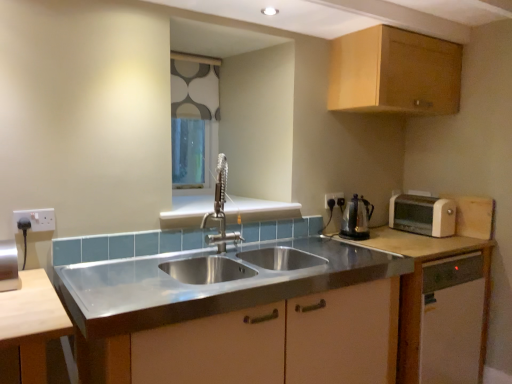
Question: Is stainless steel sink at center, which is counted as the 2th cabinetry, starting from the bottom, placed right next to white matte cabinet at right, the first cabinetry from the bottom?

Choices:
 (A) yes
 (B) no

Answer: (B)

Question: Can you confirm if stainless steel sink at center, marked as the 2th cabinetry in a top-to-bottom arrangement, is thinner than white matte cabinet at right, the first cabinetry from the bottom?

Choices:
 (A) no
 (B) yes

Answer: (A)

Question: Is stainless steel sink at center, which is counted as the 2th cabinetry, starting from the bottom, positioned behind white matte cabinet at right, which appears as the third cabinetry when viewed from the top?

Choices:
 (A) yes
 (B) no

Answer: (B)

Question: From a real-world perspective, is stainless steel sink at center, which is counted as the 2th cabinetry, starting from the bottom, on top of white matte cabinet at right, the first cabinetry from the bottom?

Choices:
 (A) yes
 (B) no

Answer: (A)

Question: Is stainless steel sink at center, which is counted as the 2th cabinetry, starting from the bottom, closer to camera compared to white matte cabinet at right, which appears as the third cabinetry when viewed from the top?

Choices:
 (A) yes
 (B) no

Answer: (A)

Question: Looking at the image, does white plastic electrical outlet at upper right, which is counted as the first electric outlet, starting from the back, seem bigger or smaller compared to shiny metallic kettle at right?

Choices:
 (A) small
 (B) big

Answer: (A)

Question: Is white plastic electrical outlet at upper right, which appears as the 2th electric outlet when viewed from the left, wider or thinner than shiny metallic kettle at right?

Choices:
 (A) thin
 (B) wide

Answer: (A)

Question: Is white plastic electrical outlet at upper right, which is counted as the first electric outlet, starting from the back, to the left or to the right of shiny metallic kettle at right in the image?

Choices:
 (A) right
 (B) left

Answer: (B)

Question: Considering the positions of white plastic electrical outlet at upper right, which appears as the 2th electric outlet when viewed from the left, and shiny metallic kettle at right in the image, is white plastic electrical outlet at upper right, which appears as the 2th electric outlet when viewed from the left, taller or shorter than shiny metallic kettle at right?

Choices:
 (A) short
 (B) tall

Answer: (A)

Question: Considering the positions of white plastic socket at left, which appears as the 2th electric outlet when viewed from the back, and white fabric at upper center in the image, is white plastic socket at left, which appears as the 2th electric outlet when viewed from the back, wider or thinner than white fabric at upper center?

Choices:
 (A) thin
 (B) wide

Answer: (A)

Question: From the image's perspective, is white plastic socket at left, which is counted as the 2th electric outlet, starting from the right, located above or below white fabric at upper center?

Choices:
 (A) above
 (B) below

Answer: (B)

Question: Considering the positions of white plastic socket at left, positioned as the 1th electric outlet in left-to-right order, and white fabric at upper center in the image, is white plastic socket at left, positioned as the 1th electric outlet in left-to-right order, bigger or smaller than white fabric at upper center?

Choices:
 (A) small
 (B) big

Answer: (A)

Question: Relative to white fabric at upper center, is white plastic socket at left, placed as the first electric outlet when sorted from front to back, in front or behind?

Choices:
 (A) front
 (B) behind

Answer: (A)

Question: From the image's perspective, relative to white matte cabinet at right, the first cabinetry from the bottom, is white plastic electrical outlet at upper right, which appears as the 2th electric outlet when viewed from the left, above or below?

Choices:
 (A) below
 (B) above

Answer: (B)

Question: Considering the positions of white plastic electrical outlet at upper right, which appears as the 2th electric outlet when viewed from the left, and white matte cabinet at right, which appears as the third cabinetry when viewed from the top, in the image, is white plastic electrical outlet at upper right, which appears as the 2th electric outlet when viewed from the left, taller or shorter than white matte cabinet at right, which appears as the third cabinetry when viewed from the top,?

Choices:
 (A) tall
 (B) short

Answer: (B)